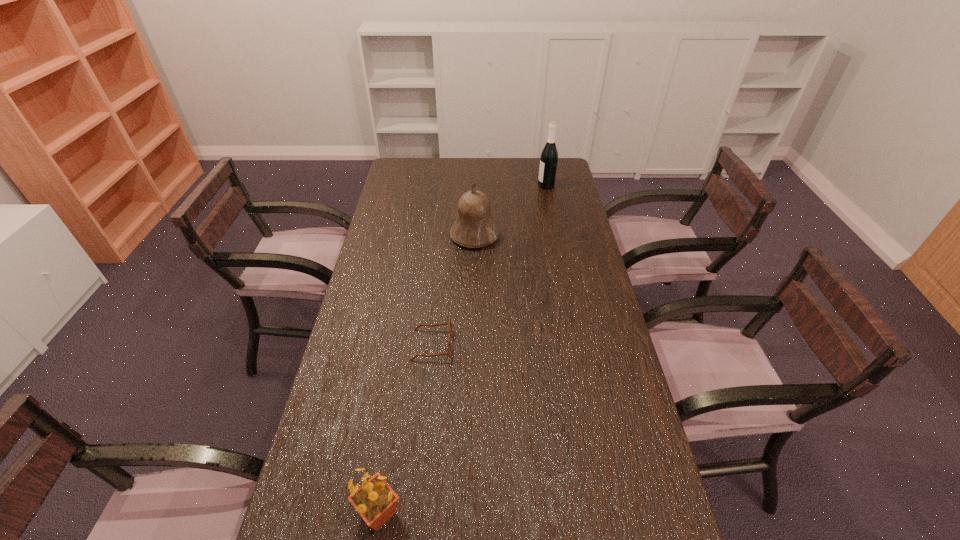
I want to click on empty space that is in between the tallest object and the third farthest object, so click(x=490, y=265).

Locate an element on the screen. empty location between the third nearest object and the third farthest object is located at coordinates (453, 290).

Point out which object is positioned as the second nearest to the shortest object. Please provide its 2D coordinates. Your answer should be formatted as a tuple, i.e. [(x, y)], where the tuple contains the x and y coordinates of a point satisfying the conditions above.

[(474, 227)]

Locate an element on the screen. The height and width of the screenshot is (540, 960). object that stands as the closest to the third nearest object is located at coordinates (549, 156).